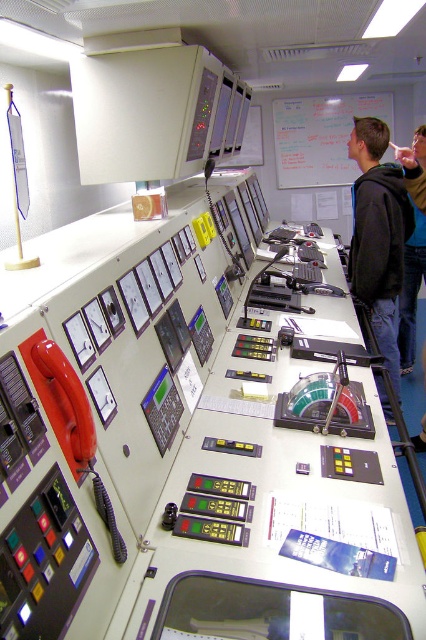
Question: Does dark gray hoodie at center appear over whiteboard at upper center?

Choices:
 (A) no
 (B) yes

Answer: (A)

Question: Among these points, which one is nearest to the camera?

Choices:
 (A) (322, 140)
 (B) (379, 186)
 (C) (414, 337)

Answer: (B)

Question: Which of the following is the farthest from the observer?

Choices:
 (A) (388, 419)
 (B) (302, 186)
 (C) (420, 188)

Answer: (B)

Question: Which of these objects is positioned closest to the blue denim jeans at lower right?

Choices:
 (A) whiteboard at upper center
 (B) dark gray hoodie at center

Answer: (B)

Question: From the image, what is the correct spatial relationship of whiteboard at upper center in relation to blue denim jeans at lower right?

Choices:
 (A) below
 (B) above

Answer: (B)

Question: Does dark gray hoodie at center have a larger size compared to blue denim jeans at lower right?

Choices:
 (A) no
 (B) yes

Answer: (B)